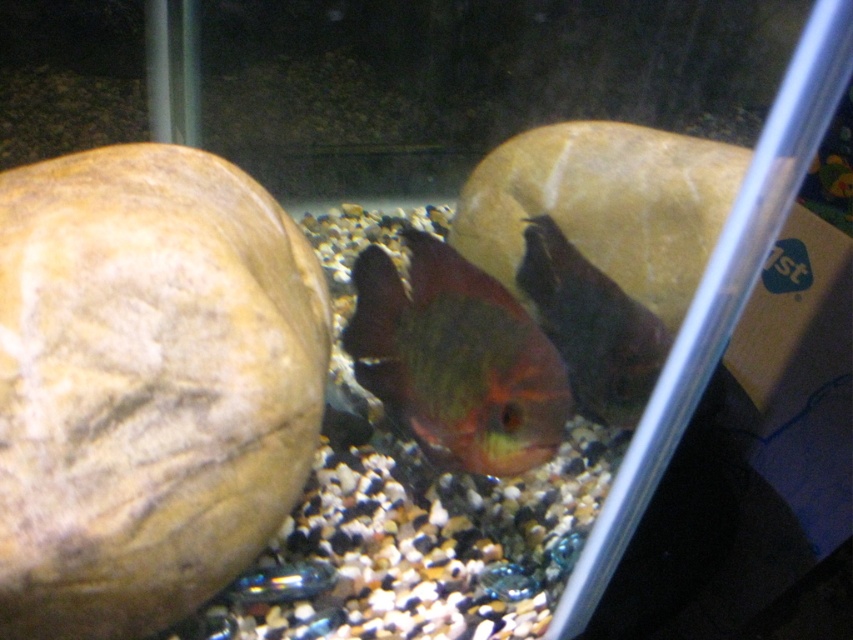
Question: Does shiny greenish fish at center lie in front of shiny metallic fish at center?

Choices:
 (A) yes
 (B) no

Answer: (A)

Question: Can you confirm if shiny greenish fish at center is positioned to the right of shiny metallic fish at center?

Choices:
 (A) yes
 (B) no

Answer: (B)

Question: Can you confirm if shiny greenish fish at center is positioned above shiny metallic fish at center?

Choices:
 (A) yes
 (B) no

Answer: (B)

Question: Which point appears closest to the camera in this image?

Choices:
 (A) (399, 417)
 (B) (541, 256)

Answer: (A)